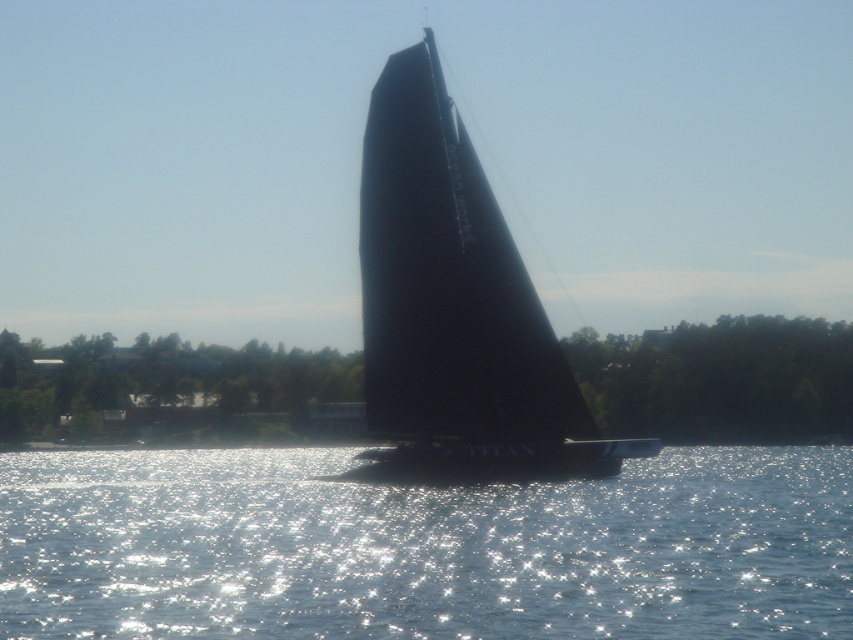
You are standing on the shore and looking at the sparkling water at center and the black matte sailboat at center. Which object is closer to you?

The sparkling water at center is closer to you because it is in front of the black matte sailboat at center.

You are a photographer trying to capture the largest possible image of the black matte sailboat at center. Given that the sparkling water at center takes up more space in your current frame, how should you adjust your camera to focus on the sailboat?

The sparkling water at center is bigger than the black matte sailboat at center, so to focus on the sailboat, you should zoom in or move closer to reduce the size of the sparkling water at center in the frame.